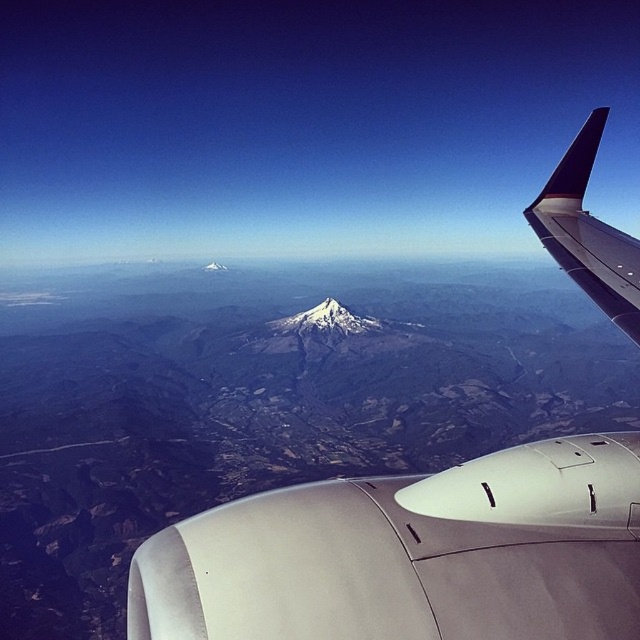
Looking at this image, you are a passenger sitting by the window and want to take a photo of the white matte engine at center and the dark blue matte winglet at upper right. Which object should you place on the left side of your photo frame?

You should place the white matte engine at center on the left side of your photo frame because it is positioned to the left of the dark blue matte winglet at upper right.

You are a flight attendant checking the aircraft components from your seat. You need to determine if the white matte engine at center can fit inside the storage compartment designed for the dark blue matte winglet at upper right. Based on their sizes, what would you conclude?

The white matte engine at center is smaller than the dark blue matte winglet at upper right. Therefore, the white matte engine at center can fit inside the storage compartment designed for the dark blue matte winglet at upper right.

You are a passenger sitting in the airplane seat and looking out the window. You see the white matte engine at center and the dark blue matte winglet at upper right. Which object is closer to your seat?

The white matte engine at center is closer to the viewer than the dark blue matte winglet at upper right, so the white matte engine at center is closer to your seat.